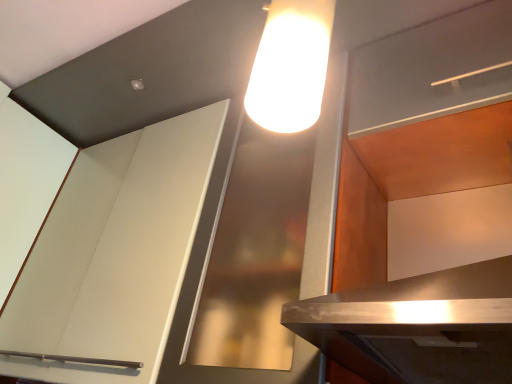
This screenshot has height=384, width=512. Identify the location of free space above matte white cabinet at upper right, which is counted as the second cabinetry, starting from the left (from a real-world perspective). (438, 148).